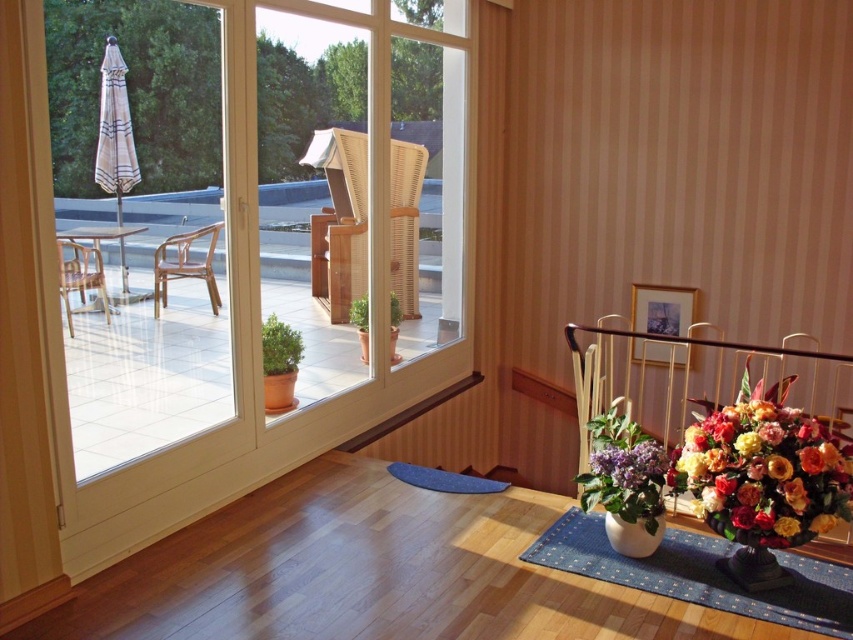
You are moving a light brown wooden chair at left to the blue fabric mat at lower right. Will the chair fit on the mat?

The blue fabric mat at lower right might be wider than light brown wooden chair at left, so the chair may fit on the mat depending on their exact dimensions.

You are standing at the entrance of the indoor space and want to place a small potted plant on the blue fabric mat at lower right. According to the scene description, where exactly should you place the plant?

The blue fabric mat at lower right is located at point (700,573), so you should place the plant there.

You are planning to place a 6 feet long sofa between the matte ceramic vase at lower right and the wooden chair at left. Can the sofa fit in the space between them?

The distance between the matte ceramic vase at lower right and the wooden chair at left is 7.00 feet, so the 6 feet long sofa can fit in the space between them since it is shorter than the available distance.